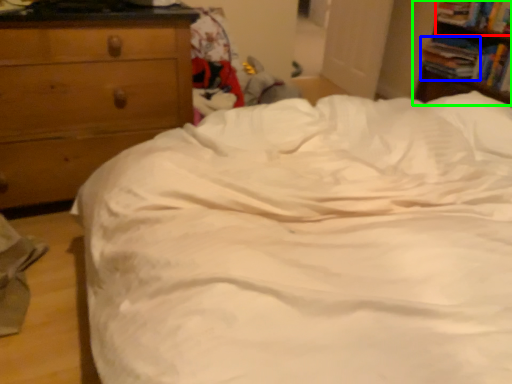
Question: Considering the real-world distances, which object is closest to book (highlighted by a red box)? book (highlighted by a blue box) or nightstand (highlighted by a green box).

Choices:
 (A) book
 (B) nightstand

Answer: (B)